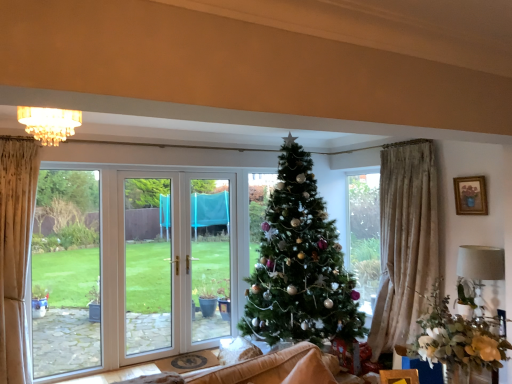
The image size is (512, 384). Find the location of `white fabric lampshade at right`. white fabric lampshade at right is located at coordinates (481, 272).

At what (x,y) coordinates should I click in order to perform the action: click on green matte christmas tree at center. Please return your answer as a coordinate pair (x, y). Image resolution: width=512 pixels, height=384 pixels. Looking at the image, I should click on (300, 265).

What is the approximate width of wooden box at lower right?

wooden box at lower right is 4.61 inches wide.

Where is `wooden box at lower right`? wooden box at lower right is located at coordinates (399, 376).

The image size is (512, 384). Identify the location of crystal chandelier at upper center. (49, 123).

This screenshot has width=512, height=384. I want to click on wooden framed picture at upper right, so click(x=470, y=195).

This screenshot has width=512, height=384. Find the location of `picture frame on the right of wooden box at lower right`. picture frame on the right of wooden box at lower right is located at coordinates (470, 195).

Looking at this image, is wooden box at lower right positioned beyond the bounds of wooden framed picture at upper right?

Absolutely, wooden box at lower right is external to wooden framed picture at upper right.

Measure the distance between wooden box at lower right and wooden framed picture at upper right.

A distance of 5.45 feet exists between wooden box at lower right and wooden framed picture at upper right.

Can you confirm if wooden box at lower right is bigger than wooden framed picture at upper right?

Yes, wooden box at lower right is bigger than wooden framed picture at upper right.

Is wooden box at lower right located outside green matte christmas tree at center?

wooden box at lower right is positioned outside green matte christmas tree at center.

Could you tell me if wooden box at lower right is facing green matte christmas tree at center?

No, wooden box at lower right is not aimed at green matte christmas tree at center.

Which of these two, wooden box at lower right or green matte christmas tree at center, stands shorter?

With less height is wooden box at lower right.

From the image's perspective, is wooden box at lower right located beneath green matte christmas tree at center?

Yes, from the image's perspective, wooden box at lower right is below green matte christmas tree at center.

Is white fabric lampshade at right not close to crystal chandelier at upper center?

Yes, white fabric lampshade at right and crystal chandelier at upper center are quite far apart.

Does white fabric lampshade at right have a smaller size compared to crystal chandelier at upper center?

No, white fabric lampshade at right is not smaller than crystal chandelier at upper center.

Is white fabric lampshade at right turned away from crystal chandelier at upper center?

No, white fabric lampshade at right is not facing away from crystal chandelier at upper center.

Can you confirm if white fabric lampshade at right is positioned to the right of crystal chandelier at upper center?

Correct, you'll find white fabric lampshade at right to the right of crystal chandelier at upper center.

Is green matte christmas tree at center thinner than crystal chandelier at upper center?

No.

Is green matte christmas tree at center bigger than crystal chandelier at upper center?

Yes, green matte christmas tree at center is bigger than crystal chandelier at upper center.

Is crystal chandelier at upper center completely or partially inside green matte christmas tree at center?

Definitely not — crystal chandelier at upper center is not inside green matte christmas tree at center.

From a real-world perspective, is green matte christmas tree at center below crystal chandelier at upper center?

Indeed, from a real-world perspective, green matte christmas tree at center is positioned beneath crystal chandelier at upper center.

Does point (380, 375) come farther from viewer compared to point (468, 265)?

No.

Can you confirm if wooden box at lower right is taller than white fabric lampshade at right?

No, wooden box at lower right is not taller than white fabric lampshade at right.

From a real-world perspective, is wooden box at lower right physically located above or below white fabric lampshade at right?

From a real-world perspective, wooden box at lower right is physically below white fabric lampshade at right.

At what (x,y) coordinates should I click in order to perform the action: click on furniture below the white fabric lampshade at right (from a real-world perspective). Please return your answer as a coordinate pair (x, y). Looking at the image, I should click on (399, 376).

Where is `picture frame behind the green matte christmas tree at center`? This screenshot has width=512, height=384. picture frame behind the green matte christmas tree at center is located at coordinates (470, 195).

How far apart are wooden framed picture at upper right and green matte christmas tree at center?

wooden framed picture at upper right is 4.93 feet away from green matte christmas tree at center.

From the image's perspective, is wooden framed picture at upper right located above or below green matte christmas tree at center?

Based on their image positions, wooden framed picture at upper right is located above green matte christmas tree at center.

In the scene shown: Between wooden framed picture at upper right and green matte christmas tree at center, which one has larger size?

With larger size is green matte christmas tree at center.

What's the angular difference between wooden box at lower right and crystal chandelier at upper center's facing directions?

The facing directions of wooden box at lower right and crystal chandelier at upper center are 33.3 degrees apart.

Find the location of a particular element. The image size is (512, 384). furniture beneath the crystal chandelier at upper center (from a real-world perspective) is located at coordinates (399, 376).

From a real-world perspective, which object rests below the other?

From a 3D spatial view, wooden box at lower right is below.

Locate an element on the screen. furniture beneath the wooden framed picture at upper right (from a real-world perspective) is located at coordinates (399, 376).

This screenshot has width=512, height=384. What are the coordinates of `christmas tree located above the wooden box at lower right (from the image's perspective)` in the screenshot? It's located at (300, 265).

Considering their positions, is green matte christmas tree at center positioned further to crystal chandelier at upper center than white fabric lampshade at right?

Among the two, white fabric lampshade at right is located further to crystal chandelier at upper center.

Estimate the real-world distances between objects in this image. Which object is closer to white fabric lampshade at right, crystal chandelier at upper center or wooden framed picture at upper right?

Based on the image, wooden framed picture at upper right appears to be nearer to white fabric lampshade at right.

Which object lies further to the anchor point crystal chandelier at upper center, wooden framed picture at upper right or green matte christmas tree at center?

Among the two, wooden framed picture at upper right is located further to crystal chandelier at upper center.

When comparing their distances from wooden framed picture at upper right, does crystal chandelier at upper center or green matte christmas tree at center seem closer?

Based on the image, green matte christmas tree at center appears to be nearer to wooden framed picture at upper right.

From the image, which object appears to be farther from wooden framed picture at upper right, crystal chandelier at upper center or wooden box at lower right?

crystal chandelier at upper center.

Which object lies nearer to the anchor point crystal chandelier at upper center, wooden box at lower right or white fabric lampshade at right?

wooden box at lower right is positioned closer to the anchor crystal chandelier at upper center.

Looking at the image, which one is located further to wooden framed picture at upper right, wooden box at lower right or green matte christmas tree at center?

The object further to wooden framed picture at upper right is wooden box at lower right.

Looking at the image, which one is located further to wooden framed picture at upper right, wooden box at lower right or white fabric lampshade at right?

wooden box at lower right lies further to wooden framed picture at upper right than the other object.

The width and height of the screenshot is (512, 384). In order to click on furniture located between crystal chandelier at upper center and wooden framed picture at upper right in the left-right direction in this screenshot , I will do `click(399, 376)`.

Image resolution: width=512 pixels, height=384 pixels. I want to click on lamp between crystal chandelier at upper center and wooden framed picture at upper right in the horizontal direction, so click(x=481, y=272).

Locate an element on the screen. The width and height of the screenshot is (512, 384). lamp between green matte christmas tree at center and wooden framed picture at upper right from left to right is located at coordinates (481, 272).

Identify the location of christmas tree located between crystal chandelier at upper center and wooden framed picture at upper right in the left-right direction. (300, 265).